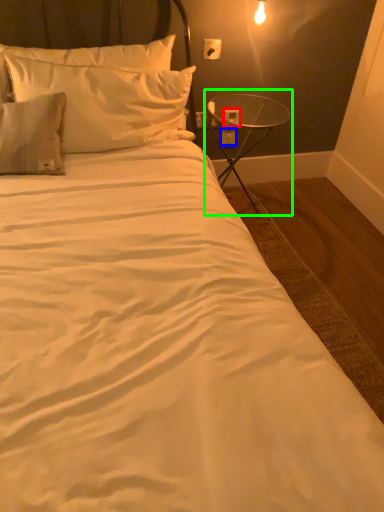
Question: Which object is positioned farthest from electric outlet (highlighted by a red box)? Select from electric outlet (highlighted by a blue box) and table (highlighted by a green box).

Choices:
 (A) electric outlet
 (B) table

Answer: (A)